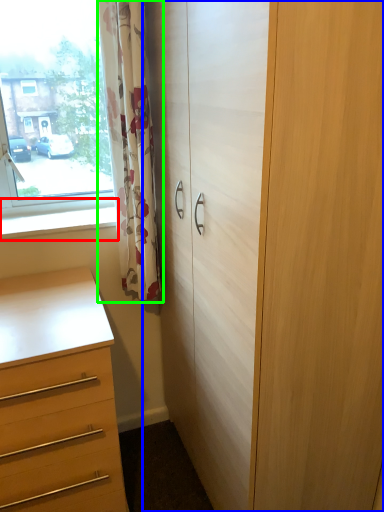
Question: Estimate the real-world distances between objects in this image. Which object is farther from window sill (highlighted by a red box), cupboard (highlighted by a blue box) or curtain (highlighted by a green box)?

Choices:
 (A) cupboard
 (B) curtain

Answer: (A)